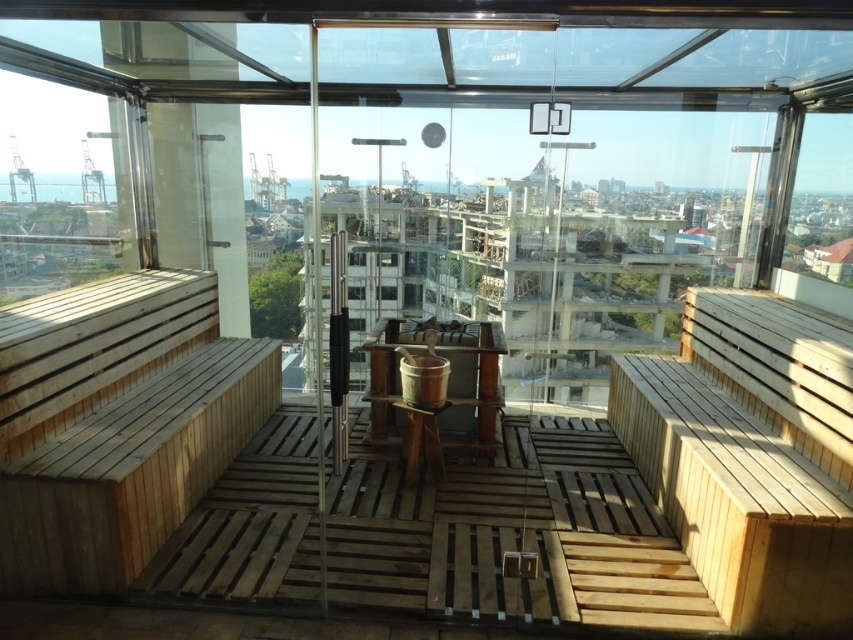
Question: Which object is farther from the camera taking this photo?

Choices:
 (A) natural wood bench at right
 (B) light brown wooden bench at left

Answer: (B)

Question: Which object is positioned farthest from the transparent glass window at left?

Choices:
 (A) light brown wooden bench at left
 (B) natural wood bench at right

Answer: (B)

Question: Which point is closer to the camera?

Choices:
 (A) transparent glass window at left
 (B) light brown wooden bench at left
 (C) natural wood bench at right

Answer: (C)

Question: Does light brown wooden bench at left have a smaller size compared to natural wood bench at right?

Choices:
 (A) yes
 (B) no

Answer: (A)

Question: Does light brown wooden bench at left have a smaller size compared to natural wood bench at right?

Choices:
 (A) no
 (B) yes

Answer: (B)

Question: Can you confirm if natural wood bench at right is thinner than transparent glass window at left?

Choices:
 (A) yes
 (B) no

Answer: (A)